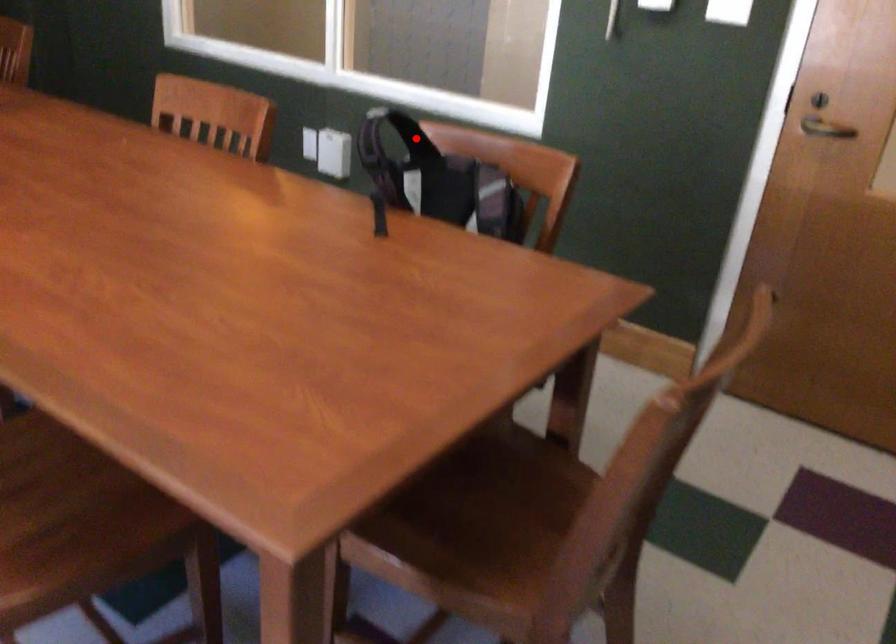
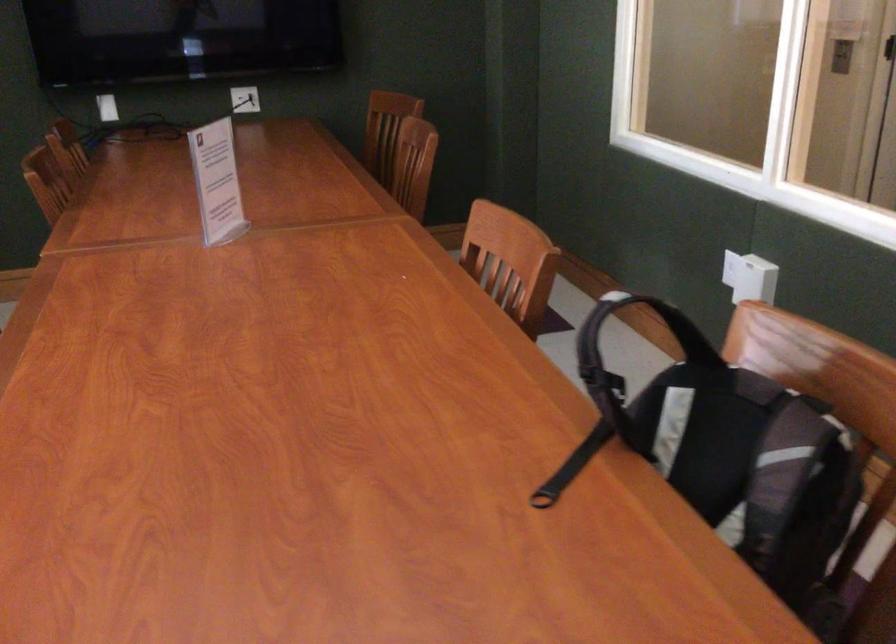
Question: I am providing you with two images of the same scene from different viewpoints. Given a red point in image1, look at the same physical point in image2. Is it:

Choices:
 (A) Closer to the viewpoint
 (B) Farther from the viewpoint

Answer: (A)